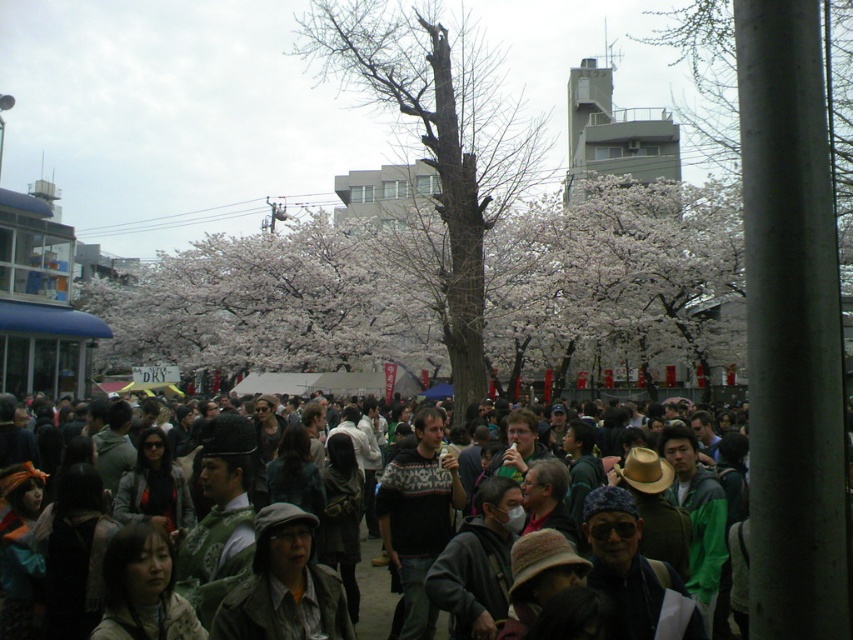
Is point (483, 68) behind point (830, 147)?

Yes, point (483, 68) is behind point (830, 147).

Does bare wood tree at center have a greater height compared to white blossoms at center?

Correct, bare wood tree at center is much taller as white blossoms at center.

Does point (439, 272) lie in front of point (728, 131)?

Yes, point (439, 272) is closer to viewer.

Locate an element on the screen. Image resolution: width=853 pixels, height=640 pixels. bare wood tree at center is located at coordinates (437, 148).

From the picture: Which is below, bare wood tree at center or dark gray jacket at center?

Positioned lower is dark gray jacket at center.

Who is positioned more to the left, bare wood tree at center or dark gray jacket at center?

bare wood tree at center is more to the left.

Between point (352, 76) and point (373, 589), which one is positioned behind?

The point (352, 76) is more distant.

Where is `bare wood tree at center`? bare wood tree at center is located at coordinates (437, 148).

Between white blossoms at center and dark gray jacket at center, which one is positioned higher?

white blossoms at center is higher up.

This screenshot has width=853, height=640. What do you see at coordinates (706, 72) in the screenshot? I see `white blossoms at center` at bounding box center [706, 72].

This screenshot has height=640, width=853. What are the coordinates of `white blossoms at center` in the screenshot? It's located at (706, 72).